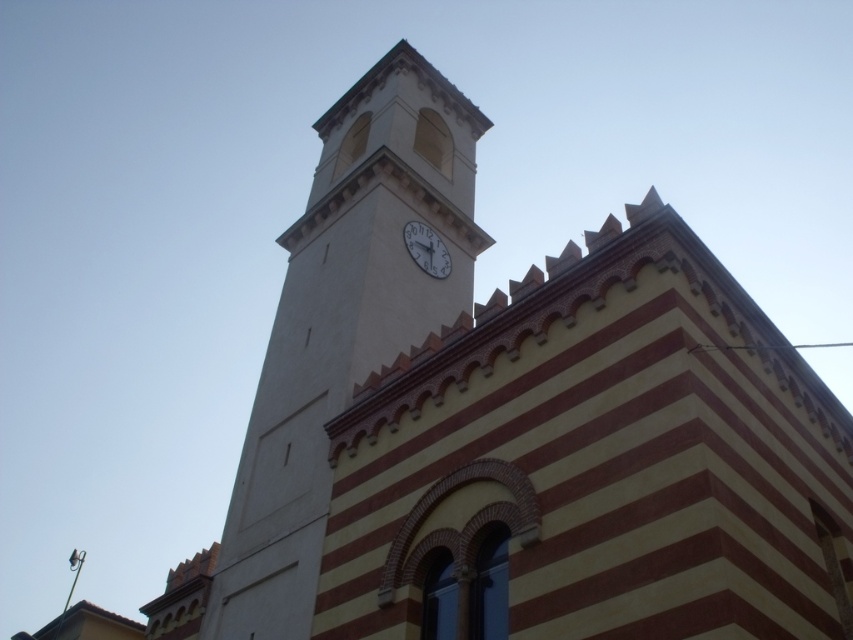
Can you confirm if white smooth clock tower at upper center is thinner than white glossy clock at center?

No, white smooth clock tower at upper center is not thinner than white glossy clock at center.

Who is more distant from viewer, (254, 563) or (407, 240)?

The point (407, 240) is more distant.

Is point (294, 333) closer to camera compared to point (419, 243)?

That is True.

Where is `white smooth clock tower at upper center`? white smooth clock tower at upper center is located at coordinates (344, 323).